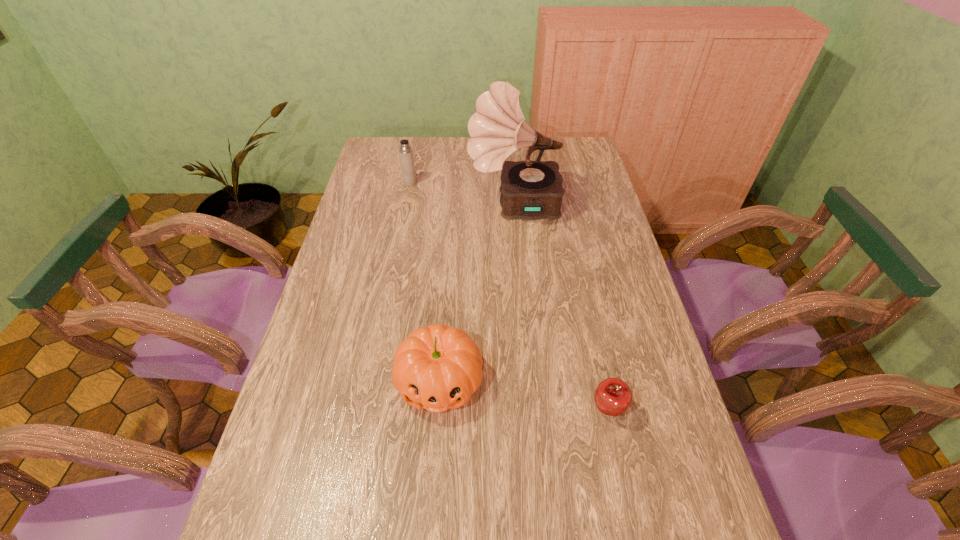
Find the location of a particular element. The image size is (960, 540). the tallest object is located at coordinates (531, 190).

Identify the location of thermos bottle. This screenshot has width=960, height=540. (405, 151).

At what (x,y) coordinates should I click in order to perform the action: click on pumpkin. Please return your answer as a coordinate pair (x, y). This screenshot has height=540, width=960. Looking at the image, I should click on (438, 367).

The width and height of the screenshot is (960, 540). Identify the location of the shortest object. (613, 396).

The width and height of the screenshot is (960, 540). In order to click on blank space located 0.230m from the horn of the tallest object in this screenshot , I will do `click(404, 205)`.

Find the location of a particular element. The image size is (960, 540). vacant position located from the horn of the tallest object is located at coordinates (435, 205).

Where is `blank space located from the horn of the tallest object`? blank space located from the horn of the tallest object is located at coordinates (413, 205).

At what (x,y) coordinates should I click in order to perform the action: click on free space located on the back of the thermos bottle. Please return your answer as a coordinate pair (x, y). Image resolution: width=960 pixels, height=540 pixels. Looking at the image, I should click on (418, 140).

The image size is (960, 540). I want to click on free space located on the carved face of the pumpkin, so click(x=433, y=465).

I want to click on free space located 0.350m on the left of the apple, so coord(444,409).